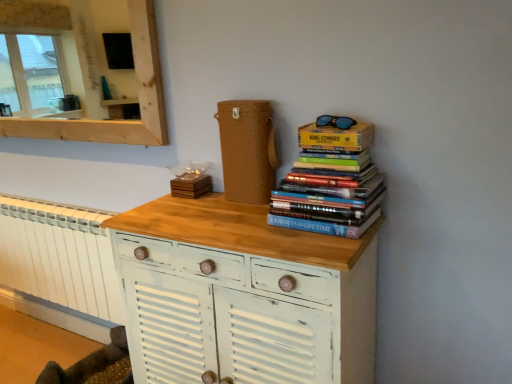
I want to click on vacant space situated above yellow cardboard box at upper right, positioned as the 2th paperback book in left-to-right order (from a real-world perspective), so click(337, 118).